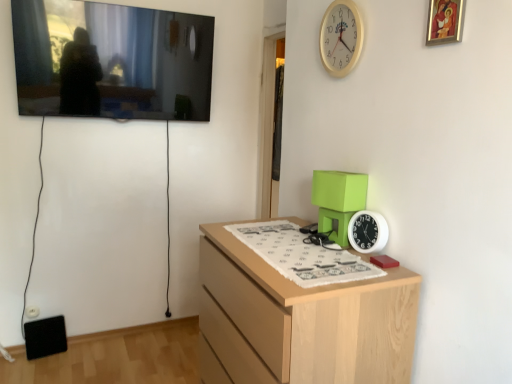
At what (x,y) coordinates should I click in order to perform the action: click on light wood chest of drawers at center. Please return your answer as a coordinate pair (x, y). Looking at the image, I should click on (307, 320).

The height and width of the screenshot is (384, 512). What do you see at coordinates (307, 320) in the screenshot?
I see `light wood chest of drawers at center` at bounding box center [307, 320].

At what (x,y) coordinates should I click in order to perform the action: click on gold-framed painting at upper right, placed as the 2th picture frame when sorted from back to front. Please return your answer as a coordinate pair (x, y). The height and width of the screenshot is (384, 512). Looking at the image, I should click on (445, 22).

This screenshot has height=384, width=512. What do you see at coordinates (111, 61) in the screenshot?
I see `flat screen tv at upper left, placed as the second picture frame when sorted from front to back` at bounding box center [111, 61].

Image resolution: width=512 pixels, height=384 pixels. I want to click on flat screen tv at upper left, which appears as the 2th picture frame when viewed from the right, so click(111, 61).

Image resolution: width=512 pixels, height=384 pixels. Identify the location of white plastic clock at right, which is counted as the 1th clock, starting from the bottom. (367, 231).

The height and width of the screenshot is (384, 512). What are the coordinates of `light wood chest of drawers at center` in the screenshot? It's located at (307, 320).

Is gold-framed painting at upper right, arranged as the first picture frame when viewed from the right, not near white plastic clock at right, the 2th clock viewed from the top?

Actually, gold-framed painting at upper right, arranged as the first picture frame when viewed from the right, and white plastic clock at right, the 2th clock viewed from the top, are a little close together.

From the image's perspective, is gold-framed painting at upper right, positioned as the 2th picture frame in left-to-right order, under white plastic clock at right, which is counted as the 1th clock, starting from the bottom?

No, from the image's perspective, gold-framed painting at upper right, positioned as the 2th picture frame in left-to-right order, is not beneath white plastic clock at right, which is counted as the 1th clock, starting from the bottom.

Looking at this image, from a real-world perspective, is gold-framed painting at upper right, placed as the 2th picture frame when sorted from back to front, above or below white plastic clock at right, which is counted as the 1th clock, starting from the bottom?

gold-framed painting at upper right, placed as the 2th picture frame when sorted from back to front, is situated higher than white plastic clock at right, which is counted as the 1th clock, starting from the bottom, in the real world.

Considering the sizes of gold-framed painting at upper right, positioned as the 2th picture frame in left-to-right order, and white plastic clock at right, the 2th clock viewed from the top, in the image, is gold-framed painting at upper right, positioned as the 2th picture frame in left-to-right order, taller or shorter than white plastic clock at right, the 2th clock viewed from the top,?

In the image, gold-framed painting at upper right, positioned as the 2th picture frame in left-to-right order, appears to be taller than white plastic clock at right, the 2th clock viewed from the top.

Is flat screen tv at upper left, which appears as the 2th picture frame when viewed from the right, positioned beyond the bounds of light wood chest of drawers at center?

Yes, flat screen tv at upper left, which appears as the 2th picture frame when viewed from the right, is not within light wood chest of drawers at center.

Based on the photo, is flat screen tv at upper left, the first picture frame from the back, smaller than light wood chest of drawers at center?

Yes.

Is flat screen tv at upper left, the first picture frame from the back, beside light wood chest of drawers at center?

No.

Which object is positioned more to the right, flat screen tv at upper left, which appears as the 2th picture frame when viewed from the right, or light wood chest of drawers at center?

Positioned to the right is light wood chest of drawers at center.

The image size is (512, 384). Find the location of `picture frame that appears below the gold-framed painting at upper right, positioned as the 2th picture frame in left-to-right order (from a real-world perspective)`. picture frame that appears below the gold-framed painting at upper right, positioned as the 2th picture frame in left-to-right order (from a real-world perspective) is located at coordinates (111, 61).

Which of these two, gold-framed painting at upper right, which is counted as the 1th picture frame, starting from the front, or flat screen tv at upper left, placed as the first picture frame when sorted from left to right, stands taller?

flat screen tv at upper left, placed as the first picture frame when sorted from left to right, is taller.

Is gold-framed painting at upper right, positioned as the 2th picture frame in left-to-right order, far from flat screen tv at upper left, which appears as the 2th picture frame when viewed from the right?

Yes, gold-framed painting at upper right, positioned as the 2th picture frame in left-to-right order, and flat screen tv at upper left, which appears as the 2th picture frame when viewed from the right, are quite far apart.

Would you say gold-framed painting at upper right, positioned as the 2th picture frame in left-to-right order, contains flat screen tv at upper left, placed as the second picture frame when sorted from front to back?

No, flat screen tv at upper left, placed as the second picture frame when sorted from front to back, is not inside gold-framed painting at upper right, positioned as the 2th picture frame in left-to-right order.

Which is closer, (123, 61) or (380, 230)?

Point (123, 61) appears to be farther away from the viewer than point (380, 230).

Considering the relative sizes of flat screen tv at upper left, placed as the first picture frame when sorted from left to right, and white plastic clock at right, which is counted as the 1th clock, starting from the bottom, in the image provided, is flat screen tv at upper left, placed as the first picture frame when sorted from left to right, smaller than white plastic clock at right, which is counted as the 1th clock, starting from the bottom,?

No.

Which of these two, flat screen tv at upper left, placed as the second picture frame when sorted from front to back, or white plastic clock at right, which is counted as the 1th clock, starting from the bottom, stands taller?

With more height is flat screen tv at upper left, placed as the second picture frame when sorted from front to back.

Considering the relative positions of flat screen tv at upper left, placed as the second picture frame when sorted from front to back, and white plastic clock at right, the 2th clock viewed from the top, in the image provided, is flat screen tv at upper left, placed as the second picture frame when sorted from front to back, behind white plastic clock at right, the 2th clock viewed from the top,?

Yes, flat screen tv at upper left, placed as the second picture frame when sorted from front to back, is further from the viewer.

Is white plastic clock at right, which is counted as the 1th clock, starting from the bottom, positioned with its back to white plastic clock at upper right, placed as the second clock when sorted from bottom to top?

That's not correct — white plastic clock at right, which is counted as the 1th clock, starting from the bottom, is not looking away from white plastic clock at upper right, placed as the second clock when sorted from bottom to top.

Can you confirm if white plastic clock at right, which is counted as the 1th clock, starting from the bottom, is smaller than white plastic clock at upper right, placed as the second clock when sorted from bottom to top?

Indeed, white plastic clock at right, which is counted as the 1th clock, starting from the bottom, has a smaller size compared to white plastic clock at upper right, placed as the second clock when sorted from bottom to top.

Between point (354, 215) and point (328, 10), which one is positioned behind?

The point (328, 10) is more distant.

Between white plastic clock at upper right, the 1th clock viewed from the top, and gold-framed painting at upper right, which is counted as the 1th picture frame, starting from the front, which one has larger width?

white plastic clock at upper right, the 1th clock viewed from the top.

Consider the image. From a real-world perspective, does white plastic clock at upper right, the 1th clock viewed from the top, stand above gold-framed painting at upper right, placed as the 2th picture frame when sorted from back to front?

No.

Is white plastic clock at upper right, placed as the second clock when sorted from bottom to top, taller or shorter than gold-framed painting at upper right, placed as the 2th picture frame when sorted from back to front?

Clearly, white plastic clock at upper right, placed as the second clock when sorted from bottom to top, is taller compared to gold-framed painting at upper right, placed as the 2th picture frame when sorted from back to front.

Which is in front, point (354, 15) or point (360, 228)?

Positioned in front is point (360, 228).

Is white plastic clock at upper right, placed as the second clock when sorted from bottom to top, inside the boundaries of white plastic clock at right, which is counted as the 1th clock, starting from the bottom, or outside?

white plastic clock at upper right, placed as the second clock when sorted from bottom to top, lies outside white plastic clock at right, which is counted as the 1th clock, starting from the bottom.

From the image's perspective, does white plastic clock at upper right, placed as the second clock when sorted from bottom to top, appear lower than white plastic clock at right, which is counted as the 1th clock, starting from the bottom?

No, from the image's perspective, white plastic clock at upper right, placed as the second clock when sorted from bottom to top, is not beneath white plastic clock at right, which is counted as the 1th clock, starting from the bottom.

This screenshot has width=512, height=384. Find the location of `picture frame that is on the right side of white plastic clock at right, the 2th clock viewed from the top`. picture frame that is on the right side of white plastic clock at right, the 2th clock viewed from the top is located at coordinates (445, 22).

The height and width of the screenshot is (384, 512). I want to click on the chest of drawers that is below the flat screen tv at upper left, placed as the first picture frame when sorted from left to right (from the image's perspective), so click(307, 320).

In the scene shown: Considering their positions, is white plastic clock at upper right, the 1th clock viewed from the top, positioned closer to flat screen tv at upper left, placed as the first picture frame when sorted from left to right, than light wood chest of drawers at center?

The object closer to flat screen tv at upper left, placed as the first picture frame when sorted from left to right, is white plastic clock at upper right, the 1th clock viewed from the top.

From the image, which object appears to be nearer to flat screen tv at upper left, placed as the first picture frame when sorted from left to right, white plastic clock at upper right, the 1th clock viewed from the top, or white plastic clock at right, which is counted as the 1th clock, starting from the bottom?

white plastic clock at upper right, the 1th clock viewed from the top.

Estimate the real-world distances between objects in this image. Which object is further from flat screen tv at upper left, which appears as the 2th picture frame when viewed from the right, gold-framed painting at upper right, placed as the 2th picture frame when sorted from back to front, or white plastic clock at upper right, the 1th clock viewed from the top?

gold-framed painting at upper right, placed as the 2th picture frame when sorted from back to front, lies further to flat screen tv at upper left, which appears as the 2th picture frame when viewed from the right, than the other object.

Estimate the real-world distances between objects in this image. Which object is closer to flat screen tv at upper left, which appears as the 2th picture frame when viewed from the right, light wood chest of drawers at center or white plastic clock at upper right, the 1th clock viewed from the top?

white plastic clock at upper right, the 1th clock viewed from the top.

Estimate the real-world distances between objects in this image. Which object is further from gold-framed painting at upper right, positioned as the 2th picture frame in left-to-right order, white plastic clock at upper right, placed as the second clock when sorted from bottom to top, or flat screen tv at upper left, placed as the first picture frame when sorted from left to right?

flat screen tv at upper left, placed as the first picture frame when sorted from left to right, lies further to gold-framed painting at upper right, positioned as the 2th picture frame in left-to-right order, than the other object.

In the scene shown: Considering their positions, is flat screen tv at upper left, which appears as the 2th picture frame when viewed from the right, positioned closer to white plastic clock at right, the 2th clock viewed from the top, than gold-framed painting at upper right, arranged as the first picture frame when viewed from the right?

gold-framed painting at upper right, arranged as the first picture frame when viewed from the right, is closer to white plastic clock at right, the 2th clock viewed from the top.

Based on their spatial positions, is light wood chest of drawers at center or white plastic clock at upper right, the 1th clock viewed from the top, closer to gold-framed painting at upper right, placed as the 2th picture frame when sorted from back to front?

Among the two, white plastic clock at upper right, the 1th clock viewed from the top, is located nearer to gold-framed painting at upper right, placed as the 2th picture frame when sorted from back to front.

Looking at the image, which one is located closer to white plastic clock at right, the 2th clock viewed from the top, white plastic clock at upper right, the 1th clock viewed from the top, or flat screen tv at upper left, placed as the first picture frame when sorted from left to right?

white plastic clock at upper right, the 1th clock viewed from the top, lies closer to white plastic clock at right, the 2th clock viewed from the top, than the other object.

This screenshot has height=384, width=512. I want to click on picture frame between white plastic clock at upper right, placed as the second clock when sorted from bottom to top, and light wood chest of drawers at center from top to bottom, so click(445, 22).

At what (x,y) coordinates should I click in order to perform the action: click on picture frame between white plastic clock at upper right, the 1th clock viewed from the top, and white plastic clock at right, the 2th clock viewed from the top, in the up-down direction. Please return your answer as a coordinate pair (x, y). The image size is (512, 384). Looking at the image, I should click on (445, 22).

Where is `clock between flat screen tv at upper left, which appears as the 2th picture frame when viewed from the right, and white plastic clock at right, which is counted as the 1th clock, starting from the bottom, from left to right`? This screenshot has height=384, width=512. clock between flat screen tv at upper left, which appears as the 2th picture frame when viewed from the right, and white plastic clock at right, which is counted as the 1th clock, starting from the bottom, from left to right is located at coordinates (341, 38).

This screenshot has height=384, width=512. I want to click on clock between white plastic clock at upper right, the 1th clock viewed from the top, and light wood chest of drawers at center, in the vertical direction, so click(367, 231).